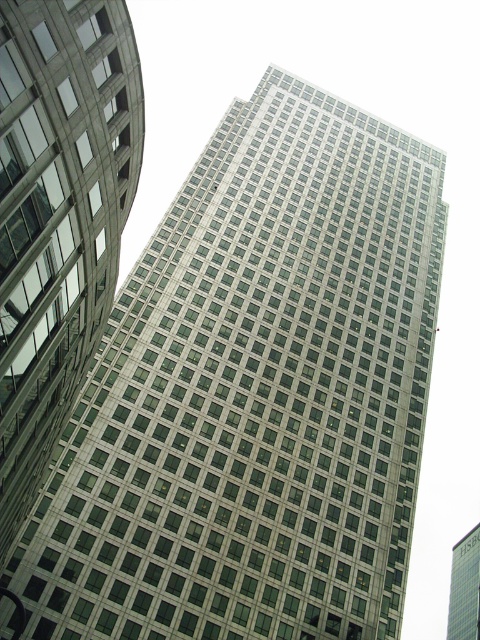
Which is behind, point (15, 515) or point (459, 561)?

The point (459, 561) is behind.

Is point (71, 246) positioned before point (451, 588)?

Yes, it is.

The height and width of the screenshot is (640, 480). Identify the location of metallic glass skyscraper at center. (58, 216).

This screenshot has width=480, height=640. Identify the location of metallic glass skyscraper at center. (58, 216).